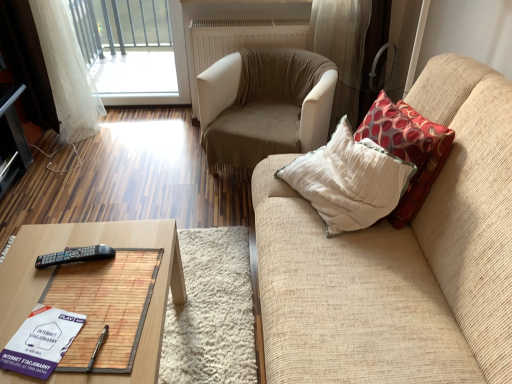
Find the location of a particular element. Image resolution: width=512 pixels, height=384 pixels. free location above woodenwoodentable at lower left (from a real-world perspective) is located at coordinates (80, 287).